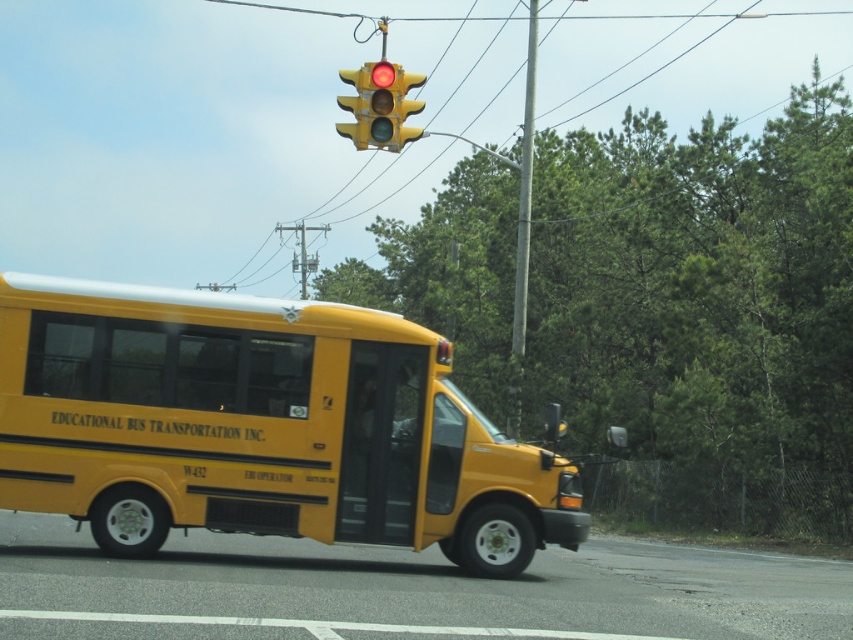
Question: Where is yellow matte bus at center located in relation to metallic gray pole at center in the image?

Choices:
 (A) below
 (B) above

Answer: (A)

Question: Which point is farther from the camera taking this photo?

Choices:
 (A) (366, 88)
 (B) (257, 529)

Answer: (A)

Question: Which of the following is the farthest from the observer?

Choices:
 (A) (338, 481)
 (B) (518, 356)

Answer: (B)

Question: Is yellow matte bus at center in front of yellow matte traffic light at upper center?

Choices:
 (A) yes
 (B) no

Answer: (A)

Question: Can you confirm if yellow matte bus at center is positioned below yellow matte traffic light at upper center?

Choices:
 (A) no
 (B) yes

Answer: (B)

Question: Which object is closer to the camera taking this photo?

Choices:
 (A) yellow matte traffic light at upper center
 (B) yellow matte bus at center

Answer: (B)